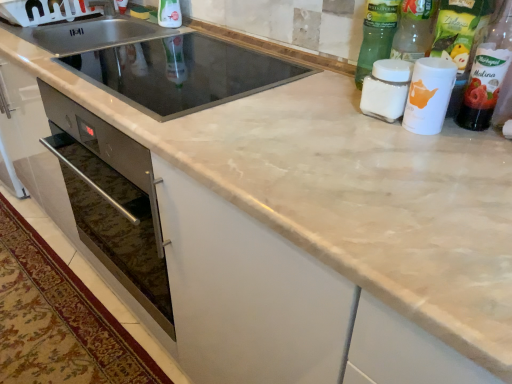
This screenshot has width=512, height=384. What are the coordinates of `vacant space to the left of white matte jar at upper right, arranged as the second bottle when viewed from the left` in the screenshot? It's located at (313, 110).